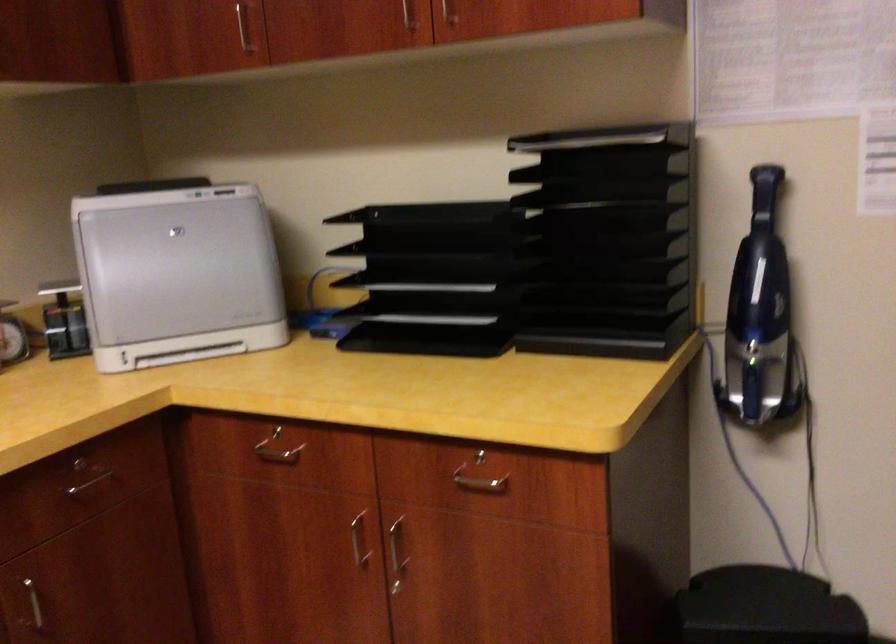
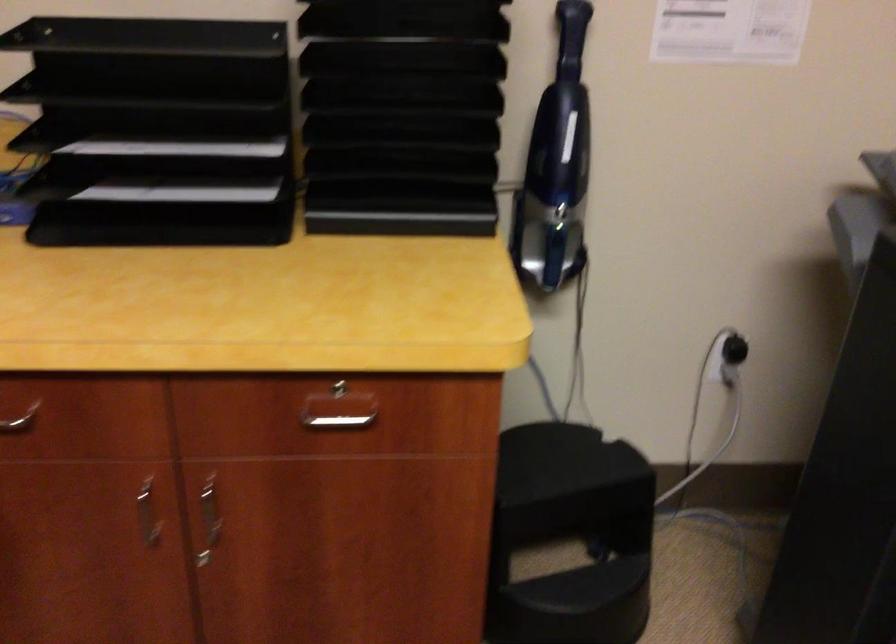
Locate, in the second image, the point that corresponds to the point at 488,462 in the first image.

(342, 391)